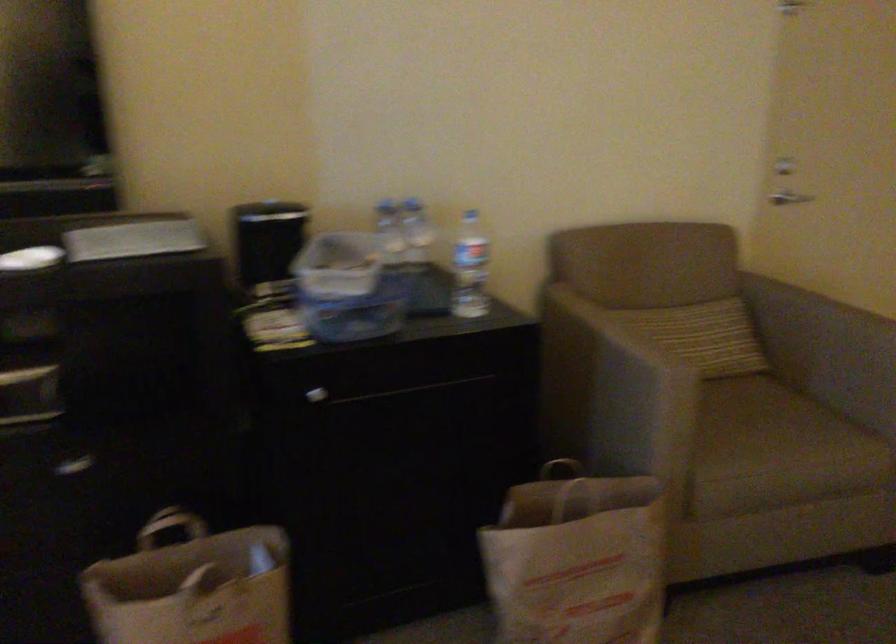
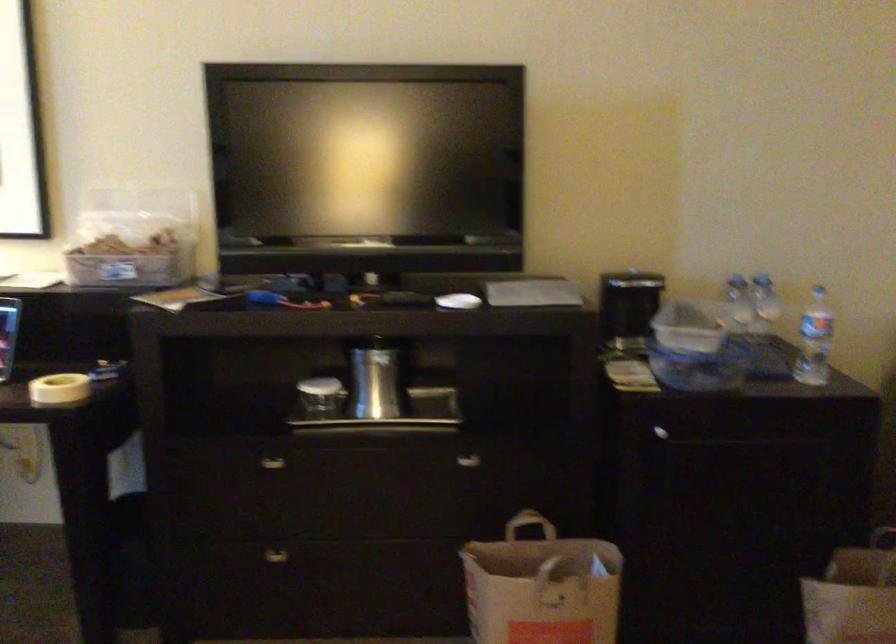
Question: Based on the continuous images, in which direction is the camera rotating? Reply with the corresponding letter.

Choices:
 (A) Left
 (B) Right
 (C) Up
 (D) Down

Answer: (A)